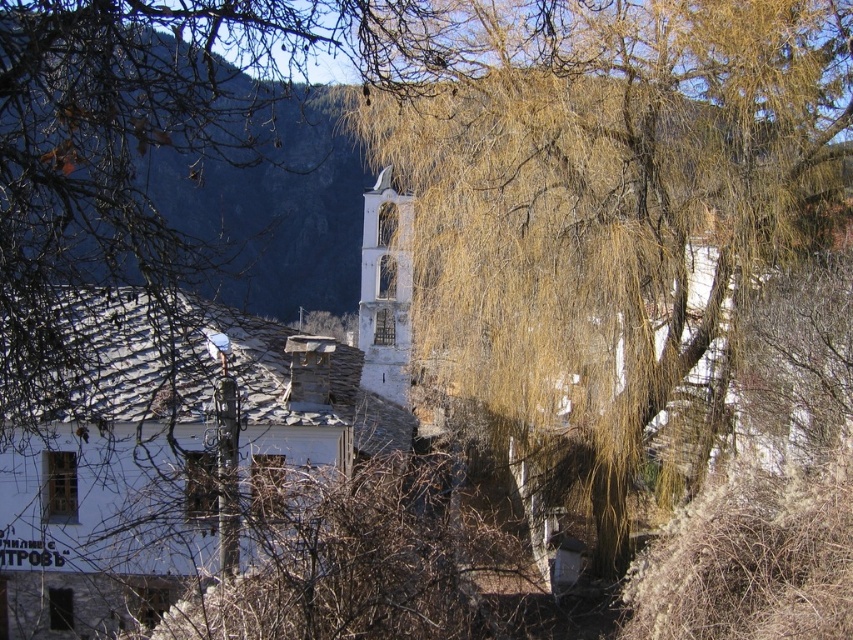
Is point (547, 323) positioned before point (378, 390)?

Yes, it is.

Where is `golden-brown textured willow at center`? The width and height of the screenshot is (853, 640). golden-brown textured willow at center is located at coordinates (605, 196).